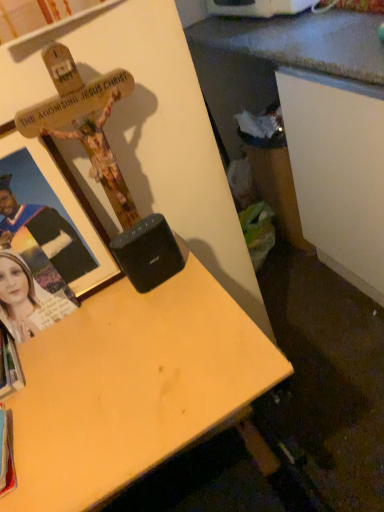
Locate an element on the screen. The image size is (384, 512). unoccupied area in front of wooden cross at upper left is located at coordinates (91, 399).